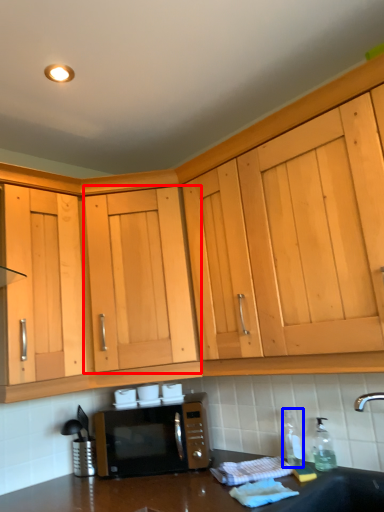
Question: Among these objects, which one is nearest to the camera, cabinetry (highlighted by a red box) or bottle (highlighted by a blue box)?

Choices:
 (A) cabinetry
 (B) bottle

Answer: (B)